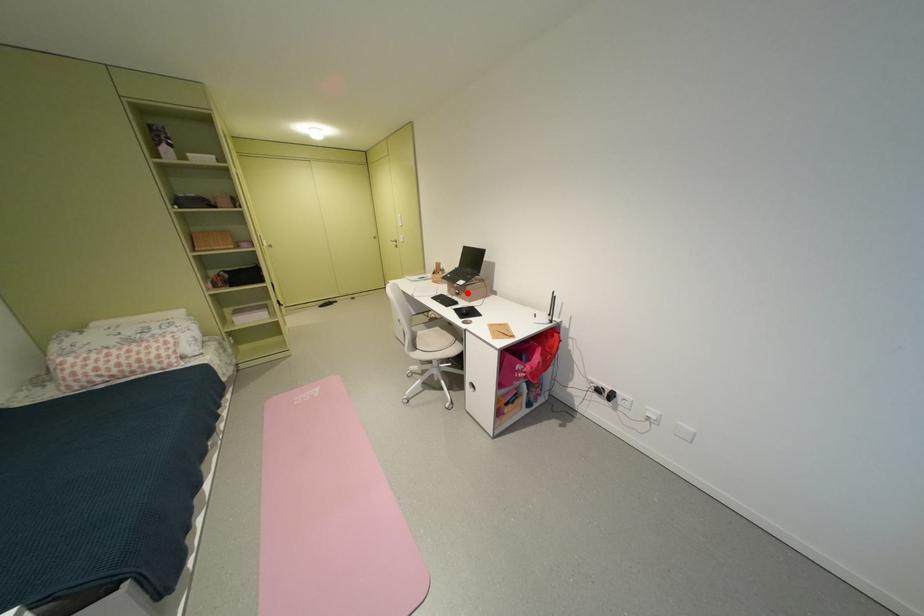
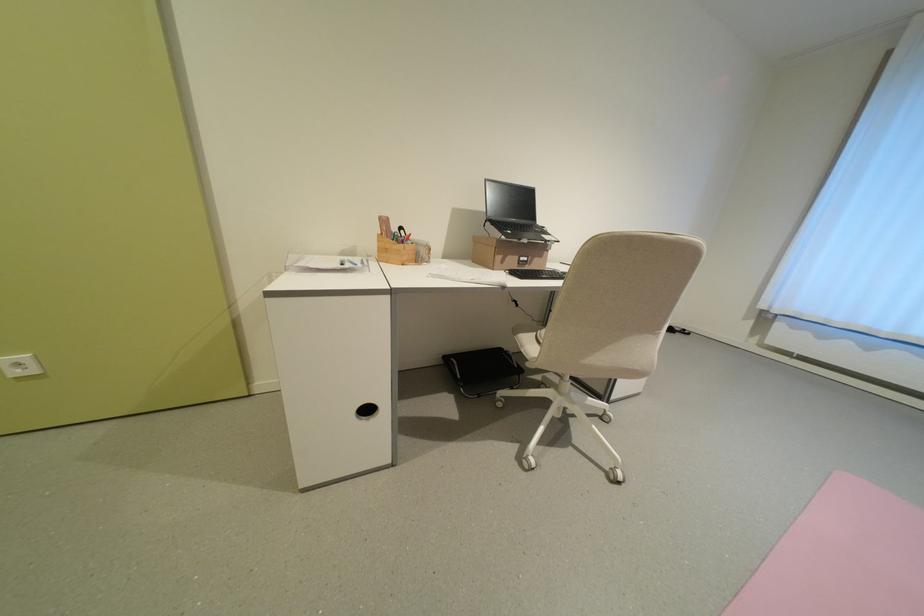
Where in the second image is the point corresponding to the highlighted location from the first image?

(536, 261)